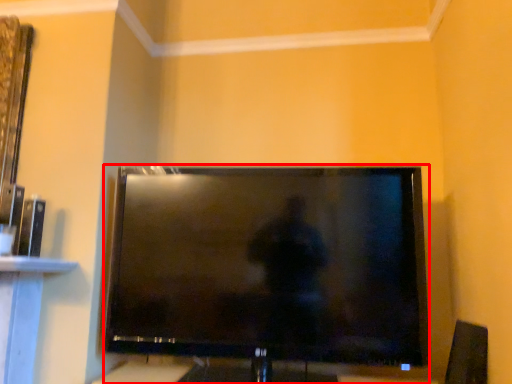
Question: From the image, what is the correct spatial relationship of television (annotated by the red box) in relation to speaker?

Choices:
 (A) right
 (B) left

Answer: (B)